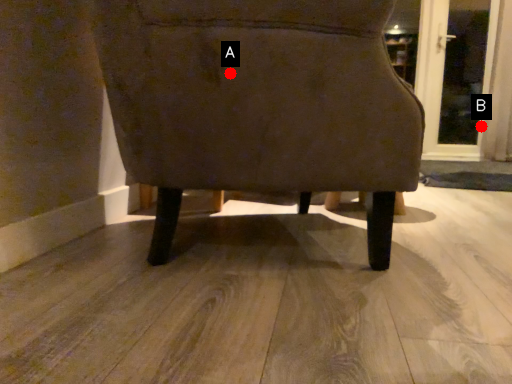
Question: Two points are circled on the image, labeled by A and B beside each circle. Which point is closer to the camera taking this photo?

Choices:
 (A) A is closer
 (B) B is closer

Answer: (A)